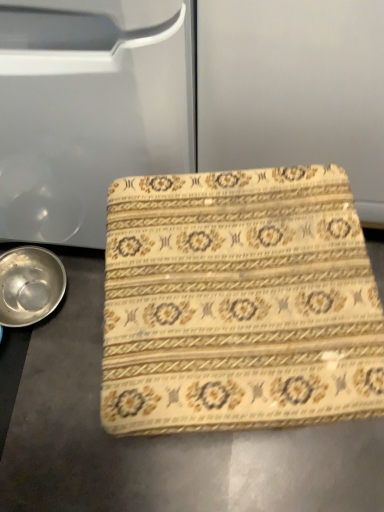
Question: In terms of size, does metallic silver bowl at lower left appear bigger or smaller than beige floral fabric at center?

Choices:
 (A) big
 (B) small

Answer: (B)

Question: Does point (39, 248) appear closer or farther from the camera than point (225, 334)?

Choices:
 (A) farther
 (B) closer

Answer: (A)

Question: Is metallic silver bowl at lower left to the left or to the right of beige floral fabric at center in the image?

Choices:
 (A) right
 (B) left

Answer: (B)

Question: In the image, is beige floral fabric at center on the left side or the right side of metallic silver bowl at lower left?

Choices:
 (A) left
 (B) right

Answer: (B)

Question: In terms of width, does beige floral fabric at center look wider or thinner when compared to metallic silver bowl at lower left?

Choices:
 (A) wide
 (B) thin

Answer: (A)

Question: Based on their sizes in the image, would you say beige floral fabric at center is bigger or smaller than metallic silver bowl at lower left?

Choices:
 (A) small
 (B) big

Answer: (B)

Question: Is point coord(324,231) closer or farther from the camera than point coord(36,321)?

Choices:
 (A) farther
 (B) closer

Answer: (B)